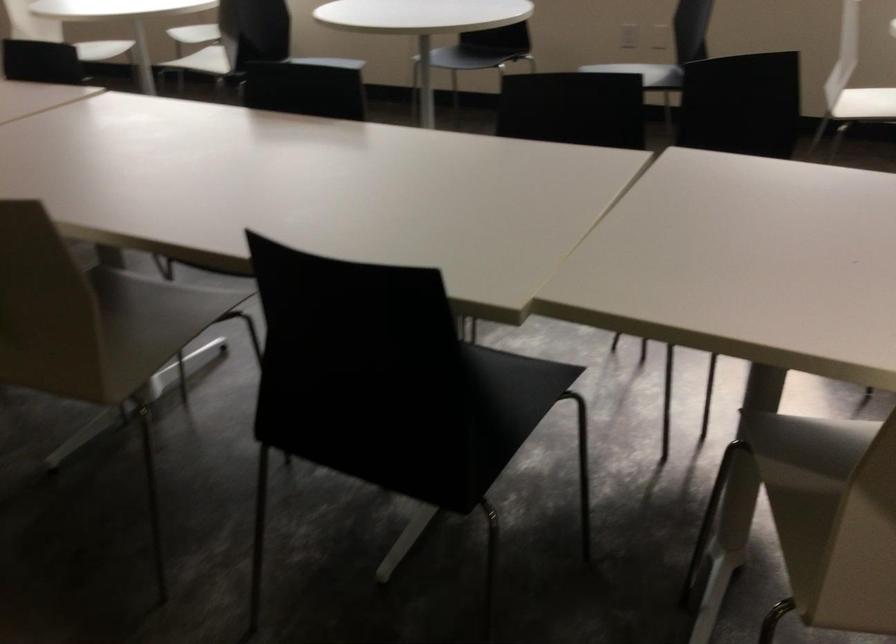
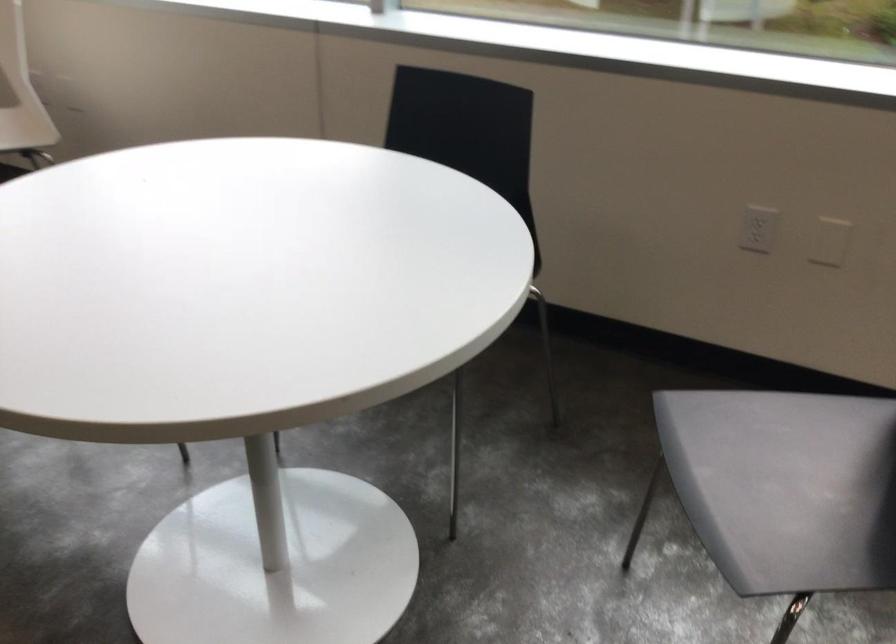
Question: What movement of the cameraman would produce the second image?

Choices:
 (A) Left
 (B) Right
 (C) Forward
 (D) Backward

Answer: (C)